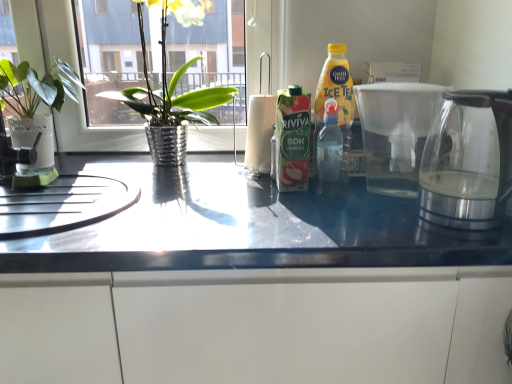
This screenshot has width=512, height=384. In order to click on free spot to the left of transparent glass kettle at right, the first coffeepot positioned from the front in this screenshot , I will do `click(375, 223)`.